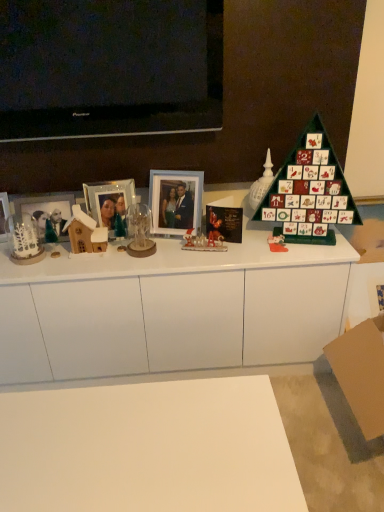
Where is `vacant area that is in front of wooden house at left, which appears as the 2th toy when viewed from the left`? This screenshot has height=512, width=384. vacant area that is in front of wooden house at left, which appears as the 2th toy when viewed from the left is located at coordinates (81, 266).